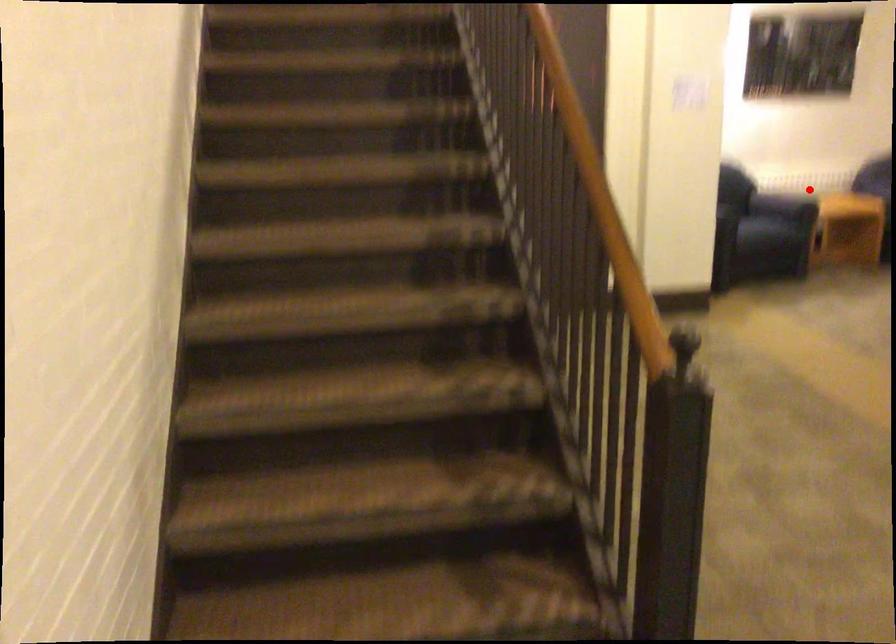
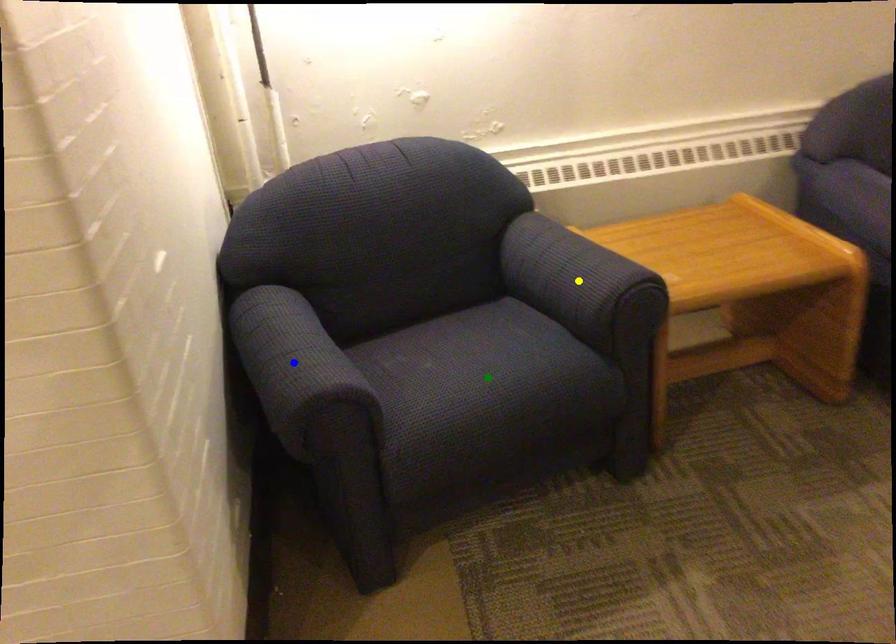
Question: I am providing you with two images of the same scene from different viewpoints. A red point is marked on the first image. You are given multiple points on the second image. Which mark in image 2 goes with the point in image 1?

Choices:
 (A) yellow point
 (B) blue point
 (C) green point

Answer: (A)